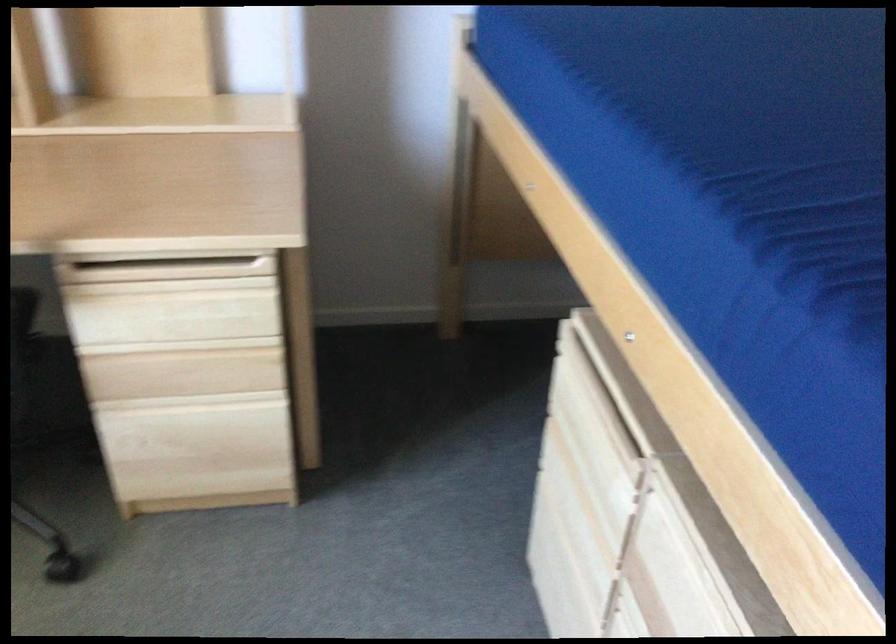
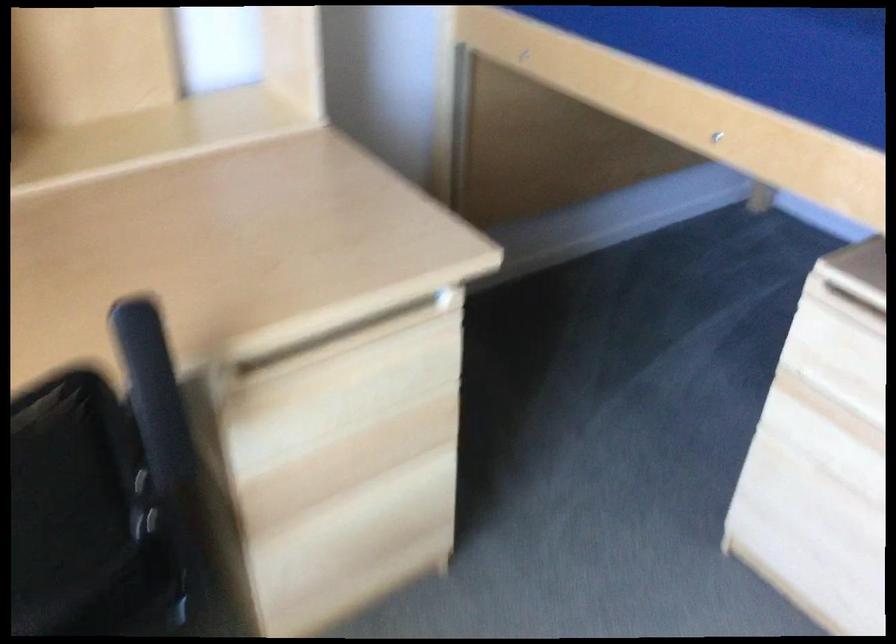
Question: The camera is either moving clockwise (left) or counter-clockwise (right) around the object. The first image is from the beginning of the video and the second image is from the end. Is the camera moving left or right when shooting the video?

Choices:
 (A) Left
 (B) Right

Answer: (A)